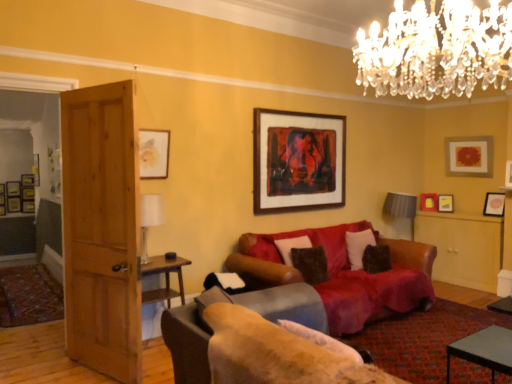
This screenshot has height=384, width=512. What are the coordinates of `matte gold picture frame at upper left, placed as the 1th picture frame when sorted from front to back` in the screenshot? It's located at (154, 153).

The width and height of the screenshot is (512, 384). Describe the element at coordinates (154, 153) in the screenshot. I see `matte gold picture frame at upper left, placed as the 1th picture frame when sorted from front to back` at that location.

Describe the element at coordinates (401, 207) in the screenshot. I see `gray fabric lampshade at right, which appears as the third lamp when viewed from the front` at that location.

Measure the distance between gray fabric lampshade at right, acting as the 1th lamp starting from the back, and camera.

gray fabric lampshade at right, acting as the 1th lamp starting from the back, is 18.43 feet away from camera.

What do you see at coordinates (13, 189) in the screenshot?
I see `wooden picture frame at left, placed as the eighth picture frame when sorted from right to left` at bounding box center [13, 189].

Measure the distance between point (445, 211) and camera.

Point (445, 211) and camera are 5.63 meters apart from each other.

Based on the photo, how much space does metallic gold picture frame at left, which is the 7th picture frame from right to left, occupy vertically?

metallic gold picture frame at left, which is the 7th picture frame from right to left, is 27.11 inches tall.

Find the location of a particular element. The height and width of the screenshot is (384, 512). wooden framed artwork at upper center, marked as the 9th picture frame in a back-to-front arrangement is located at coordinates (298, 161).

The width and height of the screenshot is (512, 384). Describe the element at coordinates (102, 230) in the screenshot. I see `natural wood door at left` at that location.

I want to click on matte gold picture frame at upper left, marked as the sixth picture frame in a right-to-left arrangement, so click(154, 153).

Which of these two, clear crystal chandelier at upper center, marked as the second lamp in a left-to-right arrangement, or matte yellow picture frame at upper right, which is counted as the 6th picture frame, starting from the back, stands taller?

With more height is clear crystal chandelier at upper center, marked as the second lamp in a left-to-right arrangement.

Image resolution: width=512 pixels, height=384 pixels. What are the coordinates of `the 3rd lamp in front of the matte yellow picture frame at upper right, which is counted as the 6th picture frame, starting from the back` in the screenshot? It's located at (436, 50).

From a real-world perspective, who is located higher, clear crystal chandelier at upper center, marked as the second lamp in a left-to-right arrangement, or matte yellow picture frame at upper right, which is counted as the 6th picture frame, starting from the back?

clear crystal chandelier at upper center, marked as the second lamp in a left-to-right arrangement.

Can we say matte gold picture frame at upper left, marked as the 5th picture frame in a left-to-right arrangement, lies outside velvet brown couch at center, which is the first studio couch in front-to-back order?

Yes.

Does matte gold picture frame at upper left, marked as the sixth picture frame in a right-to-left arrangement, appear on the right side of velvet brown couch at center, which is the first studio couch in front-to-back order?

Incorrect, matte gold picture frame at upper left, marked as the sixth picture frame in a right-to-left arrangement, is not on the right side of velvet brown couch at center, which is the first studio couch in front-to-back order.

From the image's perspective, is matte gold picture frame at upper left, placed as the 1th picture frame when sorted from front to back, on velvet brown couch at center, which is the first studio couch in front-to-back order?

Correct, matte gold picture frame at upper left, placed as the 1th picture frame when sorted from front to back, appears higher than velvet brown couch at center, which is the first studio couch in front-to-back order, in the image.

Could matte pink picture frame at upper right, which is counted as the 10th picture frame, starting from the left, be considered to be inside velvet brown couch at center, which is the first studio couch in front-to-back order?

No, matte pink picture frame at upper right, which is counted as the 10th picture frame, starting from the left, is not a part of velvet brown couch at center, which is the first studio couch in front-to-back order.

From the picture: Which is more to the right, velvet brown couch at center, which is the first studio couch in front-to-back order, or matte pink picture frame at upper right, placed as the first picture frame when sorted from right to left?

matte pink picture frame at upper right, placed as the first picture frame when sorted from right to left, is more to the right.

Considering the sizes of objects velvet brown couch at center, placed as the second studio couch when sorted from back to front, and matte pink picture frame at upper right, positioned as the third picture frame in front-to-back order, in the image provided, who is shorter, velvet brown couch at center, placed as the second studio couch when sorted from back to front, or matte pink picture frame at upper right, positioned as the third picture frame in front-to-back order,?

matte pink picture frame at upper right, positioned as the third picture frame in front-to-back order, is shorter.

Measure the distance from velvet brown couch at center, placed as the second studio couch when sorted from back to front, to matte pink picture frame at upper right, which is counted as the 10th picture frame, starting from the left.

The distance of velvet brown couch at center, placed as the second studio couch when sorted from back to front, from matte pink picture frame at upper right, which is counted as the 10th picture frame, starting from the left, is 4.20 meters.

From a real-world perspective, is metallic gold picture frame at left, the seventh picture frame in the front-to-back sequence, positioned above or below white glass lamp at left, which appears as the third lamp when viewed from the right?

Clearly, from a real-world perspective, metallic gold picture frame at left, the seventh picture frame in the front-to-back sequence, is above white glass lamp at left, which appears as the third lamp when viewed from the right.

Visually, is metallic gold picture frame at left, which is counted as the 4th picture frame, starting from the left, positioned to the left or to the right of white glass lamp at left, positioned as the second lamp in bottom-to-top order?

In the image, metallic gold picture frame at left, which is counted as the 4th picture frame, starting from the left, appears on the left side of white glass lamp at left, positioned as the second lamp in bottom-to-top order.

Which is more distant, (38, 163) or (154, 199)?

The point (38, 163) is more distant.

Does metallic gold picture frame at left, the seventh picture frame in the front-to-back sequence, have a greater height compared to white glass lamp at left, the 2th lamp viewed from the top?

Yes, metallic gold picture frame at left, the seventh picture frame in the front-to-back sequence, is taller than white glass lamp at left, the 2th lamp viewed from the top.

Considering the relative sizes of matte yellow picture frame at upper right, acting as the 3th picture frame starting from the right, and matte pink picture frame at upper right, placed as the first picture frame when sorted from right to left, in the image provided, is matte yellow picture frame at upper right, acting as the 3th picture frame starting from the right, thinner than matte pink picture frame at upper right, placed as the first picture frame when sorted from right to left,?

Incorrect, the width of matte yellow picture frame at upper right, acting as the 3th picture frame starting from the right, is not less than that of matte pink picture frame at upper right, placed as the first picture frame when sorted from right to left.

In the image, is matte yellow picture frame at upper right, which is counted as the 6th picture frame, starting from the back, on the left side or the right side of matte pink picture frame at upper right, which is counted as the 10th picture frame, starting from the left?

Based on their positions, matte yellow picture frame at upper right, which is counted as the 6th picture frame, starting from the back, is located to the left of matte pink picture frame at upper right, which is counted as the 10th picture frame, starting from the left.

Is matte pink picture frame at upper right, placed as the first picture frame when sorted from right to left, surrounded by matte yellow picture frame at upper right, arranged as the 8th picture frame when viewed from the left?

No, matte pink picture frame at upper right, placed as the first picture frame when sorted from right to left, is not inside matte yellow picture frame at upper right, arranged as the 8th picture frame when viewed from the left.

Does matte yellow picture frame at upper right, placed as the fifth picture frame when sorted from front to back, have a larger size compared to matte pink picture frame at upper right, placed as the first picture frame when sorted from right to left?

Yes.

From the image's perspective, is matte wooden picture frame at upper left, the 1th picture frame from the left, below wooden cabinet at right?

Actually, matte wooden picture frame at upper left, the 1th picture frame from the left, appears above wooden cabinet at right in the image.

Is matte wooden picture frame at upper left, acting as the 8th picture frame starting from the front, in contact with wooden cabinet at right?

No, matte wooden picture frame at upper left, acting as the 8th picture frame starting from the front, is not with wooden cabinet at right.

Is matte wooden picture frame at upper left, placed as the 3th picture frame when sorted from back to front, positioned in front of wooden cabinet at right?

That is False.

Which of these two, wooden picture frame at left, the second picture frame in the left-to-right sequence, or white soft pillow at right, acting as the 2th pillow starting from the left, is wider?

white soft pillow at right, acting as the 2th pillow starting from the left, is wider.

Between point (20, 203) and point (349, 254), which one is positioned in front?

The point (349, 254) is closer to the camera.

From the image's perspective, who appears lower, wooden picture frame at left, the ninth picture frame from the right, or white soft pillow at right, the 1th pillow positioned from the back?

From the image's view, white soft pillow at right, the 1th pillow positioned from the back, is below.

At what (x,y) coordinates should I click in order to perform the action: click on pillow that is the 1st one below the wooden picture frame at left, the ninth picture frame from the right (from a real-world perspective). Please return your answer as a coordinate pair (x, y). Image resolution: width=512 pixels, height=384 pixels. Looking at the image, I should click on (358, 246).

From a real-world perspective, count 8th picture frames downward from the clear crystal chandelier at upper center, positioned as the 3th lamp in back-to-front order, and point to it. Please provide its 2D coordinates.

[(445, 203)]

Which studio couch is the 2nd one when counting from the front of the matte gold picture frame at upper left, marked as the 5th picture frame in a left-to-right arrangement? Please provide its 2D coordinates.

[(258, 343)]

Which object lies nearer to the anchor point velvet brown couch at center, placed as the second studio couch when sorted from back to front, metallic gold picture frame at left, which is counted as the 4th picture frame, starting from the left, or matte gold picture frame at upper right, which is the second picture frame from right to left?

Based on the image, matte gold picture frame at upper right, which is the second picture frame from right to left, appears to be nearer to velvet brown couch at center, placed as the second studio couch when sorted from back to front.

Estimate the real-world distances between objects in this image. Which object is further from velvet dark brown pillow at center, the second pillow positioned from the right, white glossy table at lower right or matte gold picture frame at upper left, marked as the 5th picture frame in a left-to-right arrangement?

white glossy table at lower right.

Estimate the real-world distances between objects in this image. Which object is closer to matte pink picture frame at upper right, which is counted as the 10th picture frame, starting from the left, matte yellow picture frame at upper right, placed as the fifth picture frame when sorted from front to back, or leather couch at center, placed as the first studio couch when sorted from back to front?

matte yellow picture frame at upper right, placed as the fifth picture frame when sorted from front to back, is positioned closer to the anchor matte pink picture frame at upper right, which is counted as the 10th picture frame, starting from the left.

Considering their positions, is matte yellow picture frame at upper right, placed as the fifth picture frame when sorted from front to back, positioned further to wooden picture frame at left, the third picture frame positioned from the left, than leather couch at center, placed as the first studio couch when sorted from back to front?

matte yellow picture frame at upper right, placed as the fifth picture frame when sorted from front to back, is further to wooden picture frame at left, the third picture frame positioned from the left.

When comparing their distances from wooden picture frame at left, marked as the ninth picture frame in a front-to-back arrangement, does matte gold picture frame at upper left, arranged as the 10th picture frame when viewed from the back, or matte yellow picture frame at upper right, which is counted as the 6th picture frame, starting from the back, seem further?

matte yellow picture frame at upper right, which is counted as the 6th picture frame, starting from the back.

Considering their positions, is matte gold picture frame at upper right, the 5th picture frame from the back, positioned further to white glossy table at lower right than matte wooden picture frame at upper left, the 1th picture frame from the left?

matte wooden picture frame at upper left, the 1th picture frame from the left, is further to white glossy table at lower right.

Consider the image. Looking at the image, which one is located further to white glossy table at lower right, matte gold picture frame at upper right, which is the 7th picture frame in left-to-right order, or wooden framed artwork at upper center, marked as the 9th picture frame in a back-to-front arrangement?

matte gold picture frame at upper right, which is the 7th picture frame in left-to-right order, is further to white glossy table at lower right.

In the scene shown: From the image, which object appears to be farther from matte gold picture frame at upper right, which is the second picture frame from right to left, matte yellow picture frame at upper right, placed as the fifth picture frame when sorted from front to back, or gray fabric lampshade at right, the 3th lamp when ordered from left to right?

Among the two, gray fabric lampshade at right, the 3th lamp when ordered from left to right, is located further to matte gold picture frame at upper right, which is the second picture frame from right to left.

Where is `cabinetry between leather couch at center, placed as the first studio couch when sorted from back to front, and matte pink picture frame at upper right, which is counted as the 10th picture frame, starting from the left`? The image size is (512, 384). cabinetry between leather couch at center, placed as the first studio couch when sorted from back to front, and matte pink picture frame at upper right, which is counted as the 10th picture frame, starting from the left is located at coordinates (463, 248).

Where is `picture frame between matte gold picture frame at upper left, marked as the sixth picture frame in a right-to-left arrangement, and white glossy table at lower right, in the horizontal direction`? This screenshot has width=512, height=384. picture frame between matte gold picture frame at upper left, marked as the sixth picture frame in a right-to-left arrangement, and white glossy table at lower right, in the horizontal direction is located at coordinates [298, 161].

The height and width of the screenshot is (384, 512). I want to click on pillow between velvet dark brown pillow at center, acting as the 1th pillow starting from the front, and matte yellow picture frame at upper right, arranged as the 8th picture frame when viewed from the left, in the horizontal direction, so click(358, 246).

This screenshot has height=384, width=512. I want to click on door between metallic gold picture frame at left, which is the 7th picture frame from right to left, and matte gold picture frame at upper right, which appears as the ninth picture frame when viewed from the left, from left to right, so click(x=102, y=230).